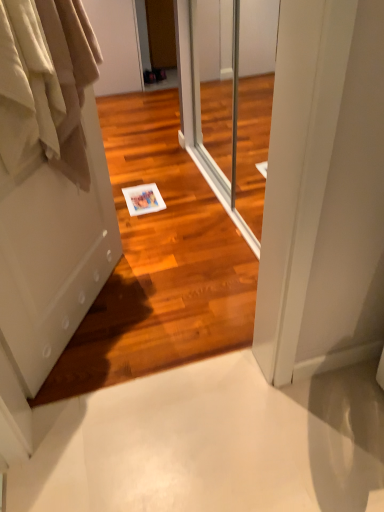
Question: Does beige cotton curtains at left have a greater height compared to transparent glass screen door at center?

Choices:
 (A) yes
 (B) no

Answer: (B)

Question: From a real-world perspective, is beige cotton curtains at left under transparent glass screen door at center?

Choices:
 (A) yes
 (B) no

Answer: (B)

Question: Is beige cotton curtains at left next to transparent glass screen door at center?

Choices:
 (A) yes
 (B) no

Answer: (B)

Question: Considering the relative positions of beige cotton curtains at left and transparent glass screen door at center in the image provided, is beige cotton curtains at left to the left of transparent glass screen door at center from the viewer's perspective?

Choices:
 (A) no
 (B) yes

Answer: (B)

Question: Does beige cotton curtains at left have a lesser width compared to transparent glass screen door at center?

Choices:
 (A) no
 (B) yes

Answer: (A)

Question: Is point (41, 111) positioned closer to the camera than point (251, 225)?

Choices:
 (A) farther
 (B) closer

Answer: (B)

Question: From the image's perspective, is beige cotton curtains at left positioned above or below transparent glass screen door at center?

Choices:
 (A) below
 (B) above

Answer: (A)

Question: Relative to transparent glass screen door at center, is beige cotton curtains at left in front or behind?

Choices:
 (A) behind
 (B) front

Answer: (B)

Question: Based on their sizes in the image, would you say beige cotton curtains at left is bigger or smaller than transparent glass screen door at center?

Choices:
 (A) small
 (B) big

Answer: (A)

Question: From the image's perspective, is transparent glass screen door at center positioned above or below white matte door at left?

Choices:
 (A) below
 (B) above

Answer: (B)

Question: Do you think transparent glass screen door at center is within white matte door at left, or outside of it?

Choices:
 (A) inside
 (B) outside

Answer: (B)

Question: From a real-world perspective, is transparent glass screen door at center physically located above or below white matte door at left?

Choices:
 (A) below
 (B) above

Answer: (A)

Question: Does point (190, 152) appear closer or farther from the camera than point (48, 46)?

Choices:
 (A) farther
 (B) closer

Answer: (A)

Question: In terms of width, does white matte door at left look wider or thinner when compared to beige cotton curtains at left?

Choices:
 (A) wide
 (B) thin

Answer: (B)

Question: From a real-world perspective, is white matte door at left positioned above or below beige cotton curtains at left?

Choices:
 (A) below
 (B) above

Answer: (A)